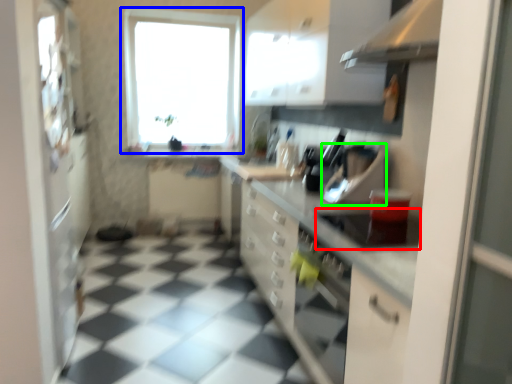
Question: Based on their relative distances, which object is farther from appliance (highlighted by a red box)? Choose from window (highlighted by a blue box) and appliance (highlighted by a green box).

Choices:
 (A) window
 (B) appliance

Answer: (A)